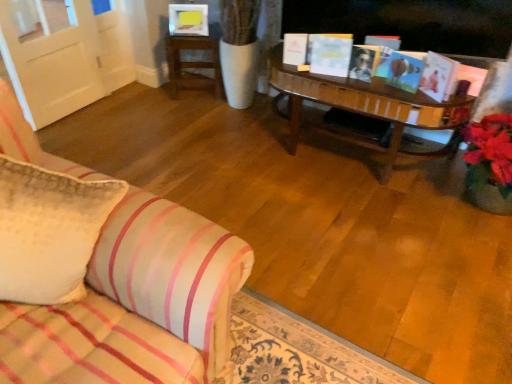
Question: Is wooden table at upper center taller than matte pink book at upper right, which is the 1th book from right to left?

Choices:
 (A) yes
 (B) no

Answer: (A)

Question: From the image's perspective, is wooden table at upper center beneath matte pink book at upper right, which ranks as the 3th book in left-to-right order?

Choices:
 (A) no
 (B) yes

Answer: (A)

Question: Is matte pink book at upper right, which ranks as the 3th book in left-to-right order, a part of wooden table at upper center?

Choices:
 (A) yes
 (B) no

Answer: (B)

Question: Does wooden table at upper center turn towards matte pink book at upper right, which ranks as the 3th book in left-to-right order?

Choices:
 (A) yes
 (B) no

Answer: (B)

Question: From a real-world perspective, is wooden table at upper center beneath matte pink book at upper right, which ranks as the 3th book in left-to-right order?

Choices:
 (A) yes
 (B) no

Answer: (A)

Question: Visually, is white paper book at center, arranged as the second book when viewed from the right, positioned to the left or to the right of matte pink book at upper right, which ranks as the 3th book in left-to-right order?

Choices:
 (A) left
 (B) right

Answer: (A)

Question: From their relative heights in the image, would you say white paper book at center, which is counted as the second book, starting from the left, is taller or shorter than matte pink book at upper right, which ranks as the 3th book in left-to-right order?

Choices:
 (A) tall
 (B) short

Answer: (A)

Question: From the image's perspective, is white paper book at center, which is counted as the second book, starting from the left, positioned above or below matte pink book at upper right, which ranks as the 3th book in left-to-right order?

Choices:
 (A) above
 (B) below

Answer: (A)

Question: Does point (352, 44) appear closer or farther from the camera than point (455, 61)?

Choices:
 (A) farther
 (B) closer

Answer: (A)

Question: Considering their positions, is wooden table at upper center located in front of or behind white matte book at upper center, marked as the third book in a right-to-left arrangement?

Choices:
 (A) behind
 (B) front

Answer: (A)

Question: In the image, is wooden table at upper center on the left side or the right side of white matte book at upper center, which is counted as the first book, starting from the left?

Choices:
 (A) left
 (B) right

Answer: (A)

Question: Looking at their shapes, would you say wooden table at upper center is wider or thinner than white matte book at upper center, marked as the third book in a right-to-left arrangement?

Choices:
 (A) wide
 (B) thin

Answer: (A)

Question: Is wooden table at upper center inside the boundaries of white matte book at upper center, which is counted as the first book, starting from the left, or outside?

Choices:
 (A) inside
 (B) outside

Answer: (B)

Question: From their relative heights in the image, would you say white textured pillow at left is taller or shorter than white paper book at center, which is counted as the second book, starting from the left?

Choices:
 (A) short
 (B) tall

Answer: (B)

Question: Looking at their shapes, would you say white textured pillow at left is wider or thinner than white paper book at center, which is counted as the second book, starting from the left?

Choices:
 (A) thin
 (B) wide

Answer: (B)